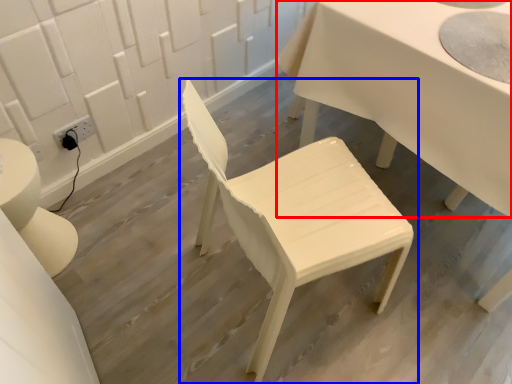
Question: Which of the following is the farthest to the observer, table (highlighted by a red box) or chair (highlighted by a blue box)?

Choices:
 (A) table
 (B) chair

Answer: (A)